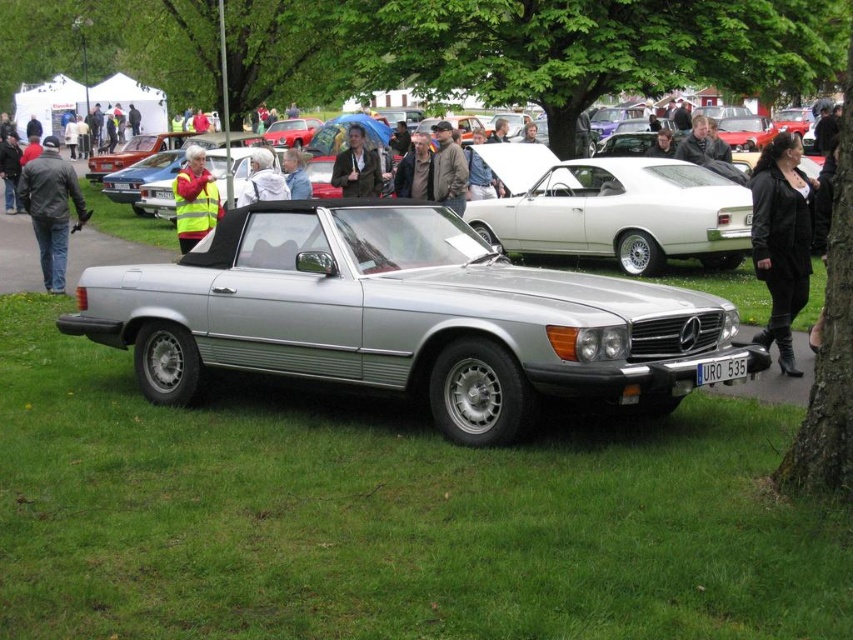
Question: Is dark brown leather jacket at center wider than light blue fabric jacket at center?

Choices:
 (A) no
 (B) yes

Answer: (A)

Question: Which point appears closest to the camera in this image?

Choices:
 (A) (602, 500)
 (B) (595, 221)
 (C) (187, 166)

Answer: (A)

Question: Which of these objects is positioned farthest from the light blue fabric jacket at center?

Choices:
 (A) yellow reflective vest at center
 (B) silver metallic convertible at center
 (C) reflective silver jacket at center
 (D) brown leather jacket at center

Answer: (B)

Question: Is dark brown leather jacket at center smaller than white plastic license plate at center?

Choices:
 (A) no
 (B) yes

Answer: (A)

Question: Among these points, which one is farthest from the camera?

Choices:
 (A) (288, 189)
 (B) (566, 196)

Answer: (B)

Question: Is black leather jacket at lower right closer to camera compared to jeans at left?

Choices:
 (A) no
 (B) yes

Answer: (B)